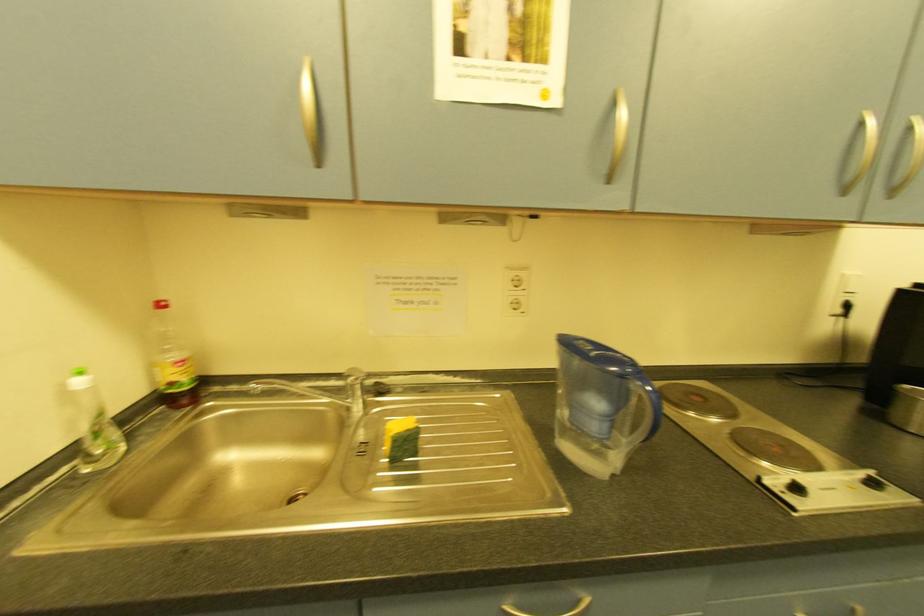
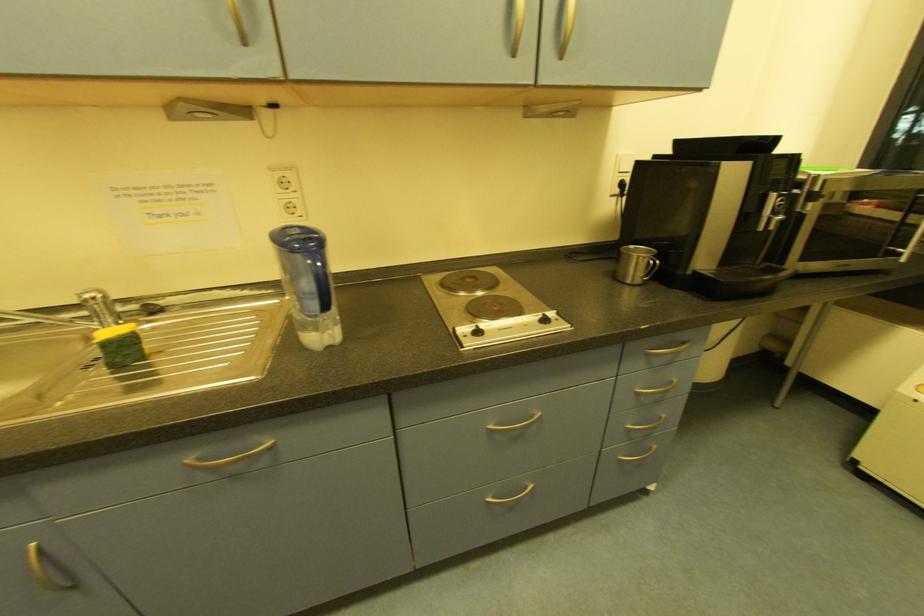
Question: The images are taken continuously from a first-person perspective. In which direction is your viewpoint rotating?

Choices:
 (A) Left
 (B) Right
 (C) Up
 (D) Down

Answer: (D)